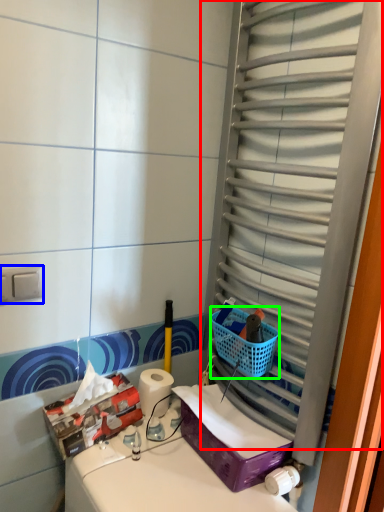
Question: Considering the real-world distances, which object is closest to glass door (highlighted by a red box)? electric outlet (highlighted by a blue box) or basket (highlighted by a green box).

Choices:
 (A) electric outlet
 (B) basket

Answer: (B)